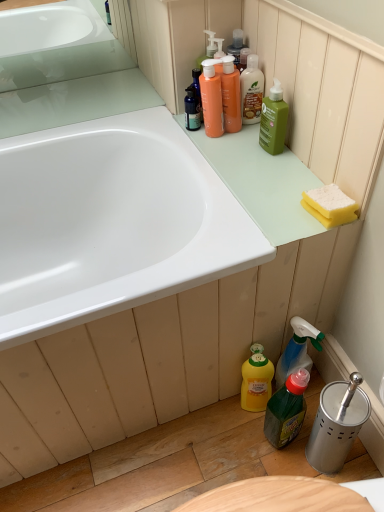
Locate an element on the screen. This screenshot has width=384, height=512. free area in between yellow sponge at upper right and matte orange pump bottles at upper center, the fourth cleaning product positioned from the bottom is located at coordinates (267, 166).